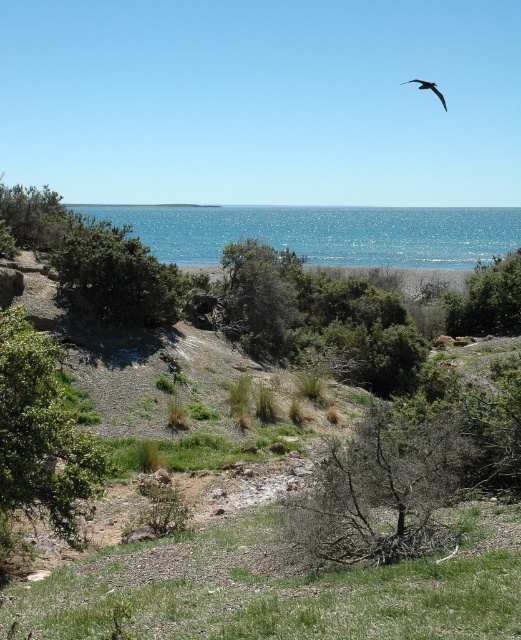
Question: Is blue glassy water at center wider than bare branches at center?

Choices:
 (A) no
 (B) yes

Answer: (B)

Question: Which of these objects is positioned farthest from the bare branches at center?

Choices:
 (A) blue glassy water at center
 (B) green leafy tree at center
 (C) green leafy bush at left

Answer: (A)

Question: Is green leafy tree at lower left positioned before green leafy tree at center?

Choices:
 (A) yes
 (B) no

Answer: (A)

Question: Among these objects, which one is farthest from the camera?

Choices:
 (A) green leafy bush at left
 (B) bare branches at center
 (C) blue glassy water at center

Answer: (C)

Question: Can you confirm if green leafy tree at lower left is wider than green leafy bush at left?

Choices:
 (A) yes
 (B) no

Answer: (B)

Question: Which object is farther from the camera taking this photo?

Choices:
 (A) green leafy tree at center
 (B) blue glassy water at center

Answer: (B)